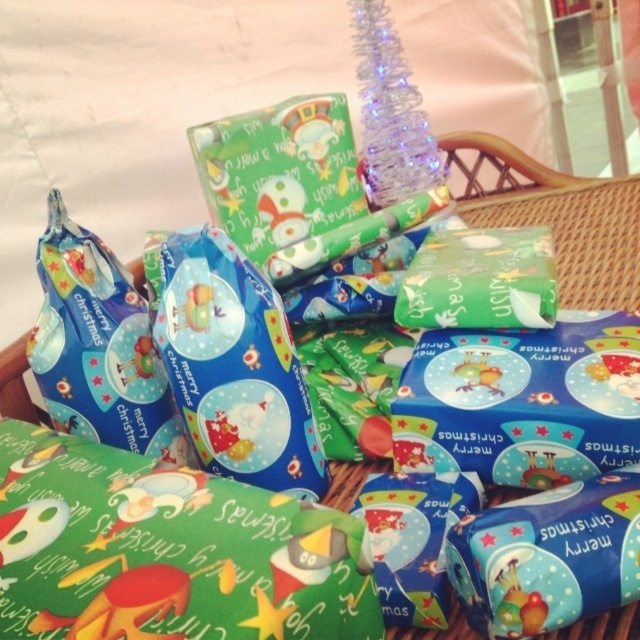
You are planning to wrap a large present and need to choose between the green shiny wrapping paper at lower left and the blue glossy gift bag at left. Which option would be more suitable for a larger item?

The green shiny wrapping paper at lower left is bigger than the blue glossy gift bag at left, making it more suitable for wrapping a larger present.

You are organizing a gift basket and need to ensure all items fit. You have a blue glossy gift bag at center and a green paper gift at center. Which item takes up more space in the basket?

The green paper gift at center occupies more space than the blue glossy gift bag at center, so it takes up more space in the basket.

You are a delivery person who needs to place a new gift into the wicker basket. The gift must be placed exactly at the center of the basket. However, there is already a blue glossy gift bag at center. Can you still place the new gift at the center?

The blue glossy gift bag at center is already located at the center of the basket at point (232, 364), so you cannot place the new gift at the center because it is already occupied by the blue glossy gift bag at center.